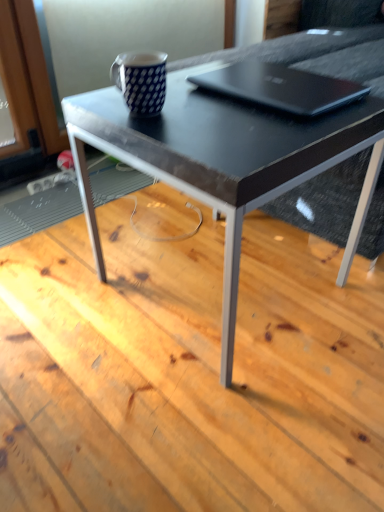
Question: Is blue dotted mug at upper center at the back of blue dotted mug at upper center?

Choices:
 (A) yes
 (B) no

Answer: (B)

Question: Is blue dotted mug at upper center behind blue dotted mug at upper center?

Choices:
 (A) yes
 (B) no

Answer: (B)

Question: Is blue dotted mug at upper center next to blue dotted mug at upper center?

Choices:
 (A) yes
 (B) no

Answer: (B)

Question: Can we say blue dotted mug at upper center lies outside blue dotted mug at upper center?

Choices:
 (A) no
 (B) yes

Answer: (B)

Question: Can you confirm if blue dotted mug at upper center is bigger than blue dotted mug at upper center?

Choices:
 (A) yes
 (B) no

Answer: (B)

Question: Do you think black matte laptop at upper center is within blue dotted mug at upper center, or outside of it?

Choices:
 (A) outside
 (B) inside

Answer: (A)

Question: Is black matte laptop at upper center bigger or smaller than blue dotted mug at upper center?

Choices:
 (A) big
 (B) small

Answer: (A)

Question: Looking at their shapes, would you say black matte laptop at upper center is wider or thinner than blue dotted mug at upper center?

Choices:
 (A) wide
 (B) thin

Answer: (A)

Question: From a real-world perspective, is black matte laptop at upper center above or below blue dotted mug at upper center?

Choices:
 (A) below
 (B) above

Answer: (A)

Question: From a real-world perspective, relative to blue dotted mug at upper center, is black glossy table at center vertically above or below?

Choices:
 (A) below
 (B) above

Answer: (A)

Question: From the image's perspective, is black glossy table at center positioned above or below blue dotted mug at upper center?

Choices:
 (A) above
 (B) below

Answer: (B)

Question: In terms of width, does black glossy table at center look wider or thinner when compared to blue dotted mug at upper center?

Choices:
 (A) wide
 (B) thin

Answer: (A)

Question: Considering the relative positions of black glossy table at center and blue dotted mug at upper center in the image provided, is black glossy table at center to the left or to the right of blue dotted mug at upper center?

Choices:
 (A) left
 (B) right

Answer: (B)

Question: Considering the positions of point (145, 79) and point (301, 99), is point (145, 79) closer or farther from the camera than point (301, 99)?

Choices:
 (A) closer
 (B) farther

Answer: (A)

Question: From a real-world perspective, is blue dotted mug at upper center positioned above or below black matte laptop at upper center?

Choices:
 (A) below
 (B) above

Answer: (B)